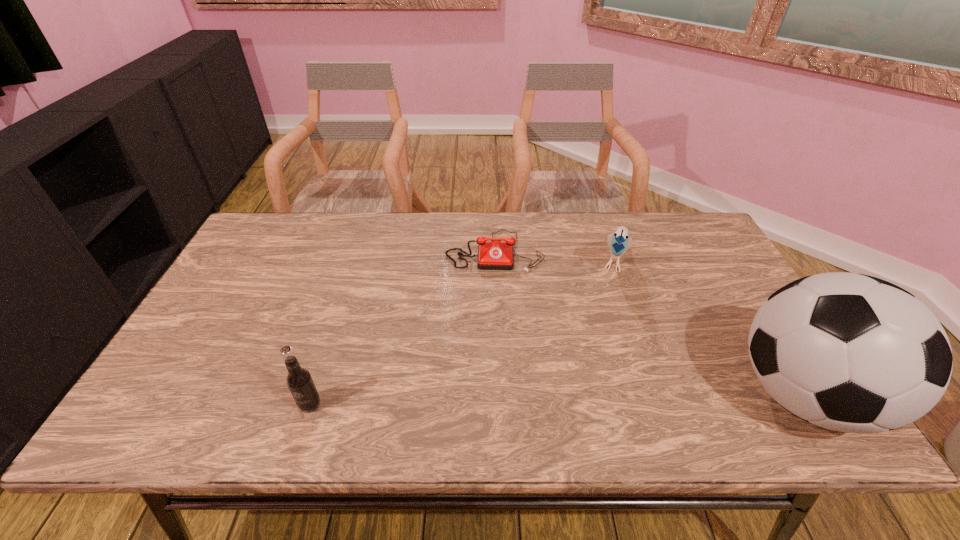
Where is `free region at the near edge`? The image size is (960, 540). free region at the near edge is located at coordinates (540, 389).

Image resolution: width=960 pixels, height=540 pixels. In the image, there is a desktop. In order to click on vacant space at the left edge in this screenshot , I will do `click(225, 323)`.

In order to click on blank space at the far right corner of the desktop in this screenshot , I will do `click(660, 219)`.

Where is `vacant space that's between the bird and the telephone`? This screenshot has height=540, width=960. vacant space that's between the bird and the telephone is located at coordinates (555, 256).

Image resolution: width=960 pixels, height=540 pixels. Find the location of `free spot between the second object from right to left and the soccer ball`. free spot between the second object from right to left and the soccer ball is located at coordinates tap(708, 328).

Locate an element on the screen. vacant space in between the tallest object and the leftmost object is located at coordinates (556, 400).

Identify the location of vacant area that lies between the leftmost object and the bird. (463, 333).

Identify the location of empty space that is in between the third object from left to right and the root beer. (463, 333).

This screenshot has width=960, height=540. I want to click on vacant area that lies between the rightmost object and the second object from right to left, so click(x=708, y=328).

Identify the location of free space between the tallest object and the root beer. (556, 400).